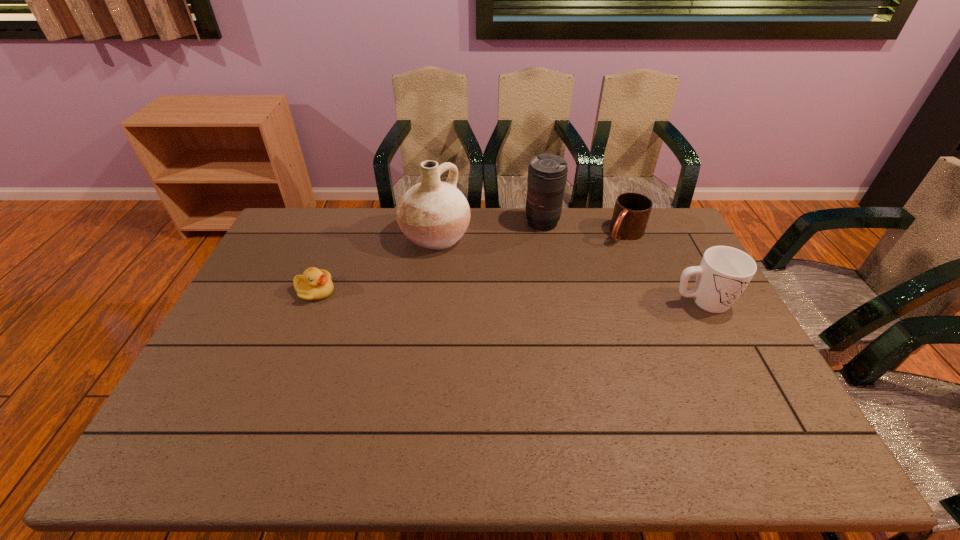
Locate an element on the screen. The image size is (960, 540). vacant space on the desktop that is between the leftmost object and the taller mug and is positioned to pour from the handle of the pottery is located at coordinates (559, 298).

Find the location of a particular element. The height and width of the screenshot is (540, 960). vacant space on the desktop that is between the duckling and the nearer mug and is positioned on the side of the shorter mug with the handle is located at coordinates (560, 298).

The height and width of the screenshot is (540, 960). In order to click on vacant space on the desktop that is between the shortest object and the taller mug and is positioned on the side of the telephoto lens where the control switches are located in this screenshot , I will do pos(505,296).